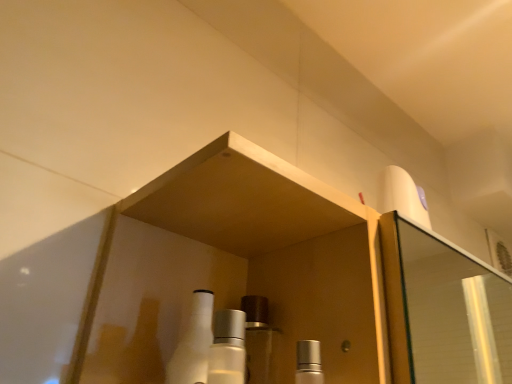
Question: Is white glossy bottle at center to the left of satin silver cap at center, positioned as the 2th mouthwash in left-to-right order, from the viewer's perspective?

Choices:
 (A) no
 (B) yes

Answer: (B)

Question: Can you confirm if white glossy bottle at center is smaller than satin silver cap at center, positioned as the 2th mouthwash in left-to-right order?

Choices:
 (A) yes
 (B) no

Answer: (B)

Question: Does white glossy bottle at center have a greater width compared to satin silver cap at center, which is the 1th mouthwash in right-to-left order?

Choices:
 (A) yes
 (B) no

Answer: (A)

Question: Considering the relative positions of white glossy bottle at center and satin silver cap at center, positioned as the 2th mouthwash in left-to-right order, in the image provided, is white glossy bottle at center in front of satin silver cap at center, positioned as the 2th mouthwash in left-to-right order,?

Choices:
 (A) yes
 (B) no

Answer: (B)

Question: Does white glossy bottle at center turn towards satin silver cap at center, positioned as the 2th mouthwash in left-to-right order?

Choices:
 (A) yes
 (B) no

Answer: (B)

Question: From their relative heights in the image, would you say satin silver cap at center, positioned as the 2th mouthwash in left-to-right order, is taller or shorter than white glossy bottle at center?

Choices:
 (A) tall
 (B) short

Answer: (B)

Question: Which is correct: satin silver cap at center, which is the 1th mouthwash in right-to-left order, is inside white glossy bottle at center, or outside of it?

Choices:
 (A) outside
 (B) inside

Answer: (A)

Question: Considering the positions of point (311, 370) and point (204, 377), is point (311, 370) closer or farther from the camera than point (204, 377)?

Choices:
 (A) closer
 (B) farther

Answer: (B)

Question: Looking at their shapes, would you say satin silver cap at center, positioned as the 2th mouthwash in left-to-right order, is wider or thinner than white glossy bottle at center?

Choices:
 (A) wide
 (B) thin

Answer: (B)

Question: Considering the positions of point (212, 370) and point (182, 334), is point (212, 370) closer or farther from the camera than point (182, 334)?

Choices:
 (A) closer
 (B) farther

Answer: (A)

Question: From the image's perspective, is satin silver bottle at center, the 2th mouthwash from the right, located above or below white glossy bottle at center?

Choices:
 (A) above
 (B) below

Answer: (A)

Question: Is satin silver bottle at center, the first mouthwash in the left-to-right sequence, taller or shorter than white glossy bottle at center?

Choices:
 (A) short
 (B) tall

Answer: (A)

Question: In terms of width, does satin silver bottle at center, the first mouthwash in the left-to-right sequence, look wider or thinner when compared to white glossy bottle at center?

Choices:
 (A) thin
 (B) wide

Answer: (A)

Question: Is white glossy bottle at center in front of or behind satin silver cap at center, positioned as the 2th mouthwash in left-to-right order, in the image?

Choices:
 (A) front
 (B) behind

Answer: (B)

Question: From a real-world perspective, is white glossy bottle at center positioned above or below satin silver cap at center, positioned as the 2th mouthwash in left-to-right order?

Choices:
 (A) above
 (B) below

Answer: (A)